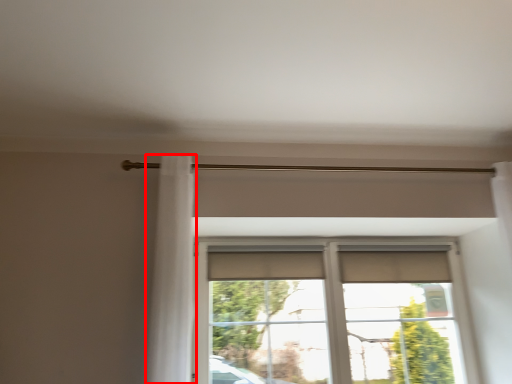
Question: Observing the image, what is the correct spatial positioning of shower curtain (annotated by the red box) in reference to window?

Choices:
 (A) right
 (B) left

Answer: (B)